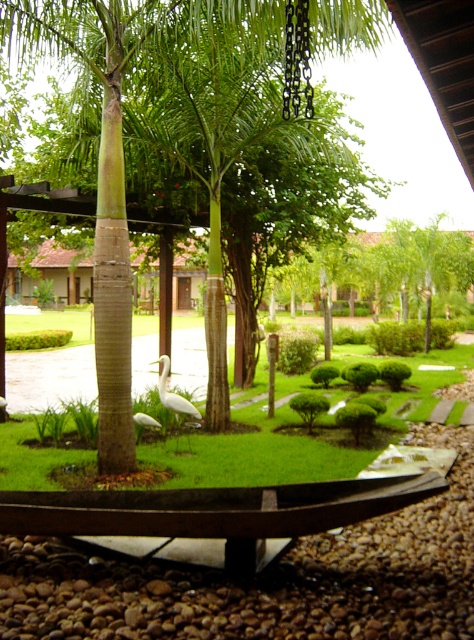
Describe the element at coordinates (293, 435) in the screenshot. The height and width of the screenshot is (640, 474). I see `green grass at center` at that location.

Between point (410, 400) and point (181, 401), which one is positioned behind?

The point (410, 400) is more distant.

In order to click on green grass at center in this screenshot , I will do (x=293, y=435).

Which is more to the left, green textured palm tree at center or white matte bird at center?

From the viewer's perspective, green textured palm tree at center appears more on the left side.

Is green textured palm tree at center bigger than white matte bird at center?

Actually, green textured palm tree at center might be smaller than white matte bird at center.

Locate an element on the screen. Image resolution: width=474 pixels, height=640 pixels. green textured palm tree at center is located at coordinates (217, 131).

Does green textured palm tree at center have a lesser height compared to green grass at center?

Correct, green textured palm tree at center is not as tall as green grass at center.

Who is taller, green textured palm tree at center or green grass at center?

green grass at center

Locate an element on the screen. green textured palm tree at center is located at coordinates (217, 131).